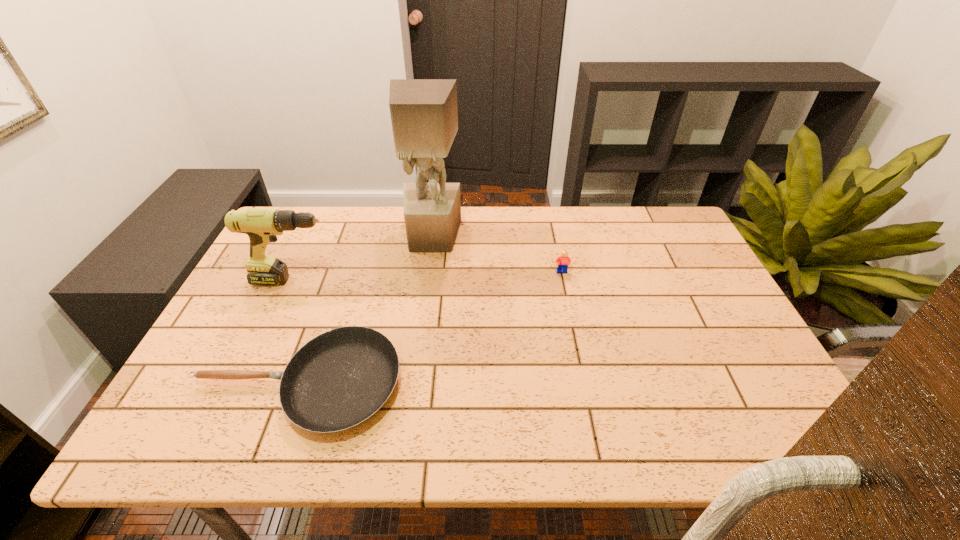
Identify the location of the tallest object. (424, 115).

The width and height of the screenshot is (960, 540). In order to click on the farthest object in this screenshot , I will do `click(424, 115)`.

At what (x,y) coordinates should I click in order to perform the action: click on the second tallest object. Please return your answer as a coordinate pair (x, y). Looking at the image, I should click on (262, 225).

Locate an element on the screen. the rightmost object is located at coordinates (564, 261).

You are a GUI agent. You are given a task and a screenshot of the screen. Output one action in this format:
    pyautogui.click(x=<x>, y=<y>)
    Task: Click on the second shortest object
    This screenshot has width=960, height=540.
    Given the screenshot: What is the action you would take?
    pyautogui.click(x=564, y=261)

I want to click on the nearest object, so click(x=337, y=380).

Where is `frying pan`? frying pan is located at coordinates coord(337,380).

You are a GUI agent. You are given a task and a screenshot of the screen. Output one action in this format:
    pyautogui.click(x=<x>, y=<y>)
    Task: Click on the vacant space located on the front-facing side of the farthest object
    
    Given the screenshot: What is the action you would take?
    pyautogui.click(x=417, y=351)

The width and height of the screenshot is (960, 540). What are the coordinates of `free space located 0.110m on the handle side of the drill` in the screenshot? It's located at 375,280.

Identify the location of free space located on the front-facing side of the Lego. The image size is (960, 540). (587, 390).